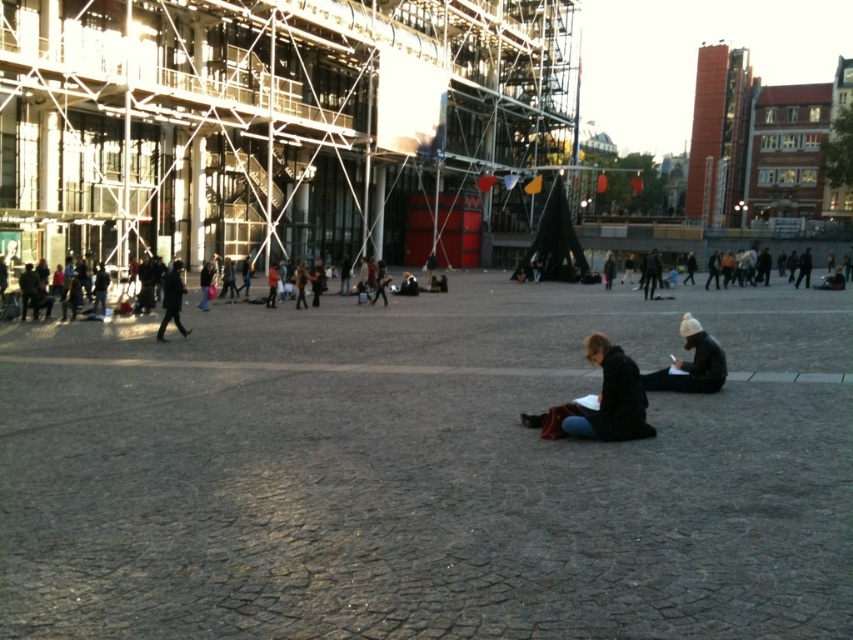
Can you confirm if jeans at center is positioned below dark gray coat at left?

Answer: Yes.

Between jeans at center and dark gray coat at left, which one has less height?

jeans at center

Does point (590, 358) come closer to viewer compared to point (180, 260)?

Yes, it is in front of point (180, 260).

This screenshot has height=640, width=853. What are the coordinates of `jeans at center` in the screenshot? It's located at (601, 401).

Between white knit hat at center and dark gray coat at left, which one is positioned higher?

Positioned higher is dark gray coat at left.

Who is more forward, (714,381) or (166,320)?

Point (714,381)

Between point (721, 364) and point (177, 269), which one is positioned behind?

The point (177, 269) is more distant.

Locate an element on the screen. The width and height of the screenshot is (853, 640). white knit hat at center is located at coordinates (691, 364).

Is jeans at center wider than white knit hat at center?

Indeed, jeans at center has a greater width compared to white knit hat at center.

Does jeans at center come behind white knit hat at center?

No, it is in front of white knit hat at center.

Between point (573, 419) and point (718, 364), which one is positioned behind?

Point (718, 364)

I want to click on jeans at center, so click(x=601, y=401).